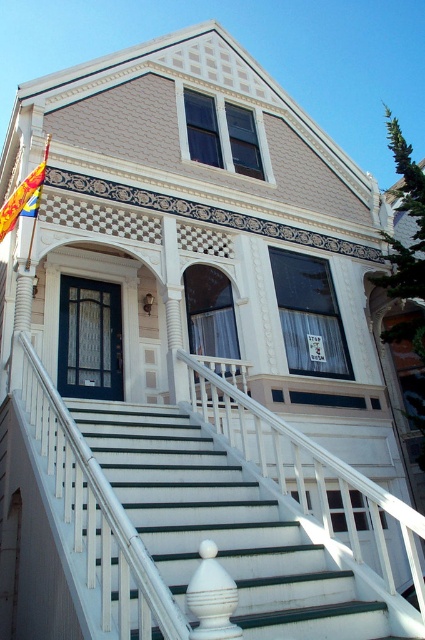
Question: Which object is the closest to the white glossy post at center?

Choices:
 (A) white painted wood stairs at center
 (B) yellow and blue striped flag at upper left

Answer: (A)

Question: Which point appears farthest from the camera in this image?

Choices:
 (A) (184, 538)
 (B) (34, 218)
 (C) (201, 554)

Answer: (B)

Question: Does white painted wood stairs at center appear over yellow and blue striped flag at upper left?

Choices:
 (A) yes
 (B) no

Answer: (B)

Question: Which point is farther from the camera taking this photo?

Choices:
 (A) coord(25,189)
 (B) coord(261,509)

Answer: (A)

Question: Can you confirm if white painted wood stairs at center is positioned below white glossy post at center?

Choices:
 (A) yes
 (B) no

Answer: (A)

Question: In this image, where is white glossy post at center located relative to yellow and blue striped flag at upper left?

Choices:
 (A) below
 (B) above

Answer: (A)